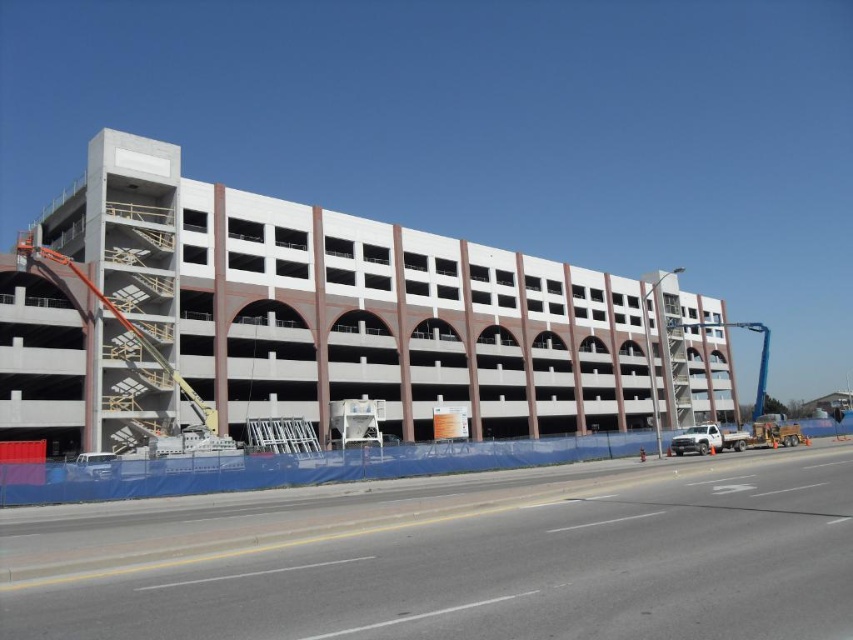
You are a construction worker who needs to cover the blue tarp at lower left with a protective cover. The white concrete parking garage at center is currently uncovered. Which object requires a larger protective cover?

The white concrete parking garage at center requires a larger protective cover because it has a larger size compared to the blue tarp at lower left.

You are a construction worker standing at the entrance of the parking structure. You need to move a heavy beam from the blue tarp at lower left to the blue metallic crane at right. Which object should you approach first to start moving the beam?

You should start by approaching the blue tarp at lower left first since it is in front of the blue metallic crane at right, making it closer to your starting position at the entrance.

You are a construction worker standing at the center of the parking structure. You need to locate the blue tarp at lower left. According to the coordinates given, where should you look relative to your position?

The blue tarp at lower left is located at coordinates point (456, 557), which is to the lower left direction from your current position at the center.